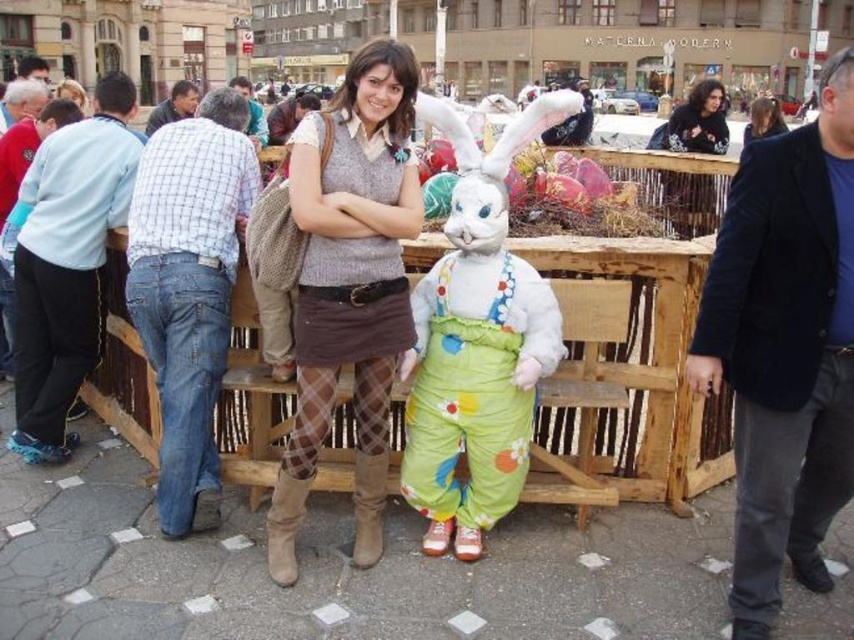
You are a delivery person who needs to place a package at the location of the brown suede boot at center. Your cart is currently parked at the light blue fleece jacket at left. Can you reach the boot without moving your cart more than 50 feet?

The distance between the light blue fleece jacket at left and the brown suede boot at center is 51.08 feet, which is more than 50 feet. Therefore, you cannot reach the brown suede boot at center without moving your cart further.

You are standing in the public square and want to take a photo of the point at coordinate point (67,436). If your camera has a maximum focus range of 30 meters, will you be able to focus on the point?

The distance of point (67,436) from viewer is 34.53 meters, which exceeds the camera maximum focus range of 30 meters, so the camera cannot focus on the point.

You are a photographer trying to capture a clear shot of both the fluffy white bunny at center and the matte brown sweater at center. Since you want both subjects to be in focus, which one should you adjust your camera focus on first?

You should focus on the fluffy white bunny at center first because it is closer to the viewer than the matte brown sweater at center, ensuring both will be in focus when using depth of field appropriately.